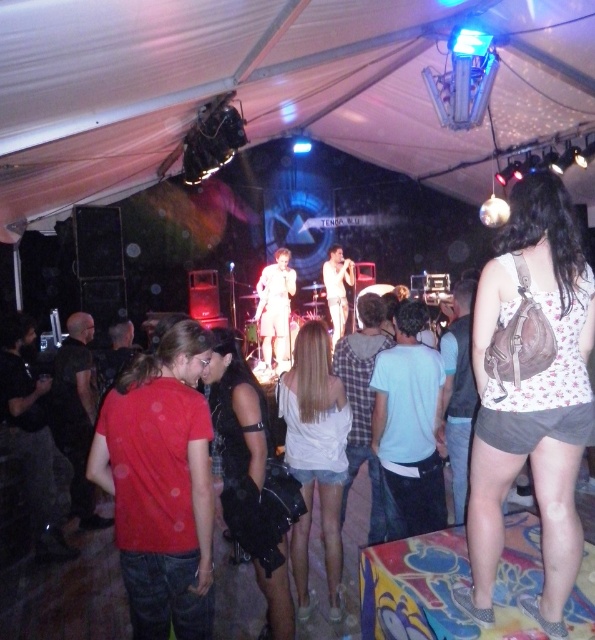
Is point (577, 401) behind point (289, 307)?

No, it is in front of (289, 307).

Measure the distance between floral-patterned fabric top at center-right and camera.

The distance of floral-patterned fabric top at center-right from camera is 6.03 feet.

Is point (493, 429) positioned in front of point (292, 292)?

Yes.

At what (x,y) coordinates should I click in order to perform the action: click on floral-patterned fabric top at center-right. Please return your answer as a coordinate pair (x, y). This screenshot has height=640, width=595. Looking at the image, I should click on (530, 394).

The height and width of the screenshot is (640, 595). What do you see at coordinates (530, 394) in the screenshot?
I see `floral-patterned fabric top at center-right` at bounding box center [530, 394].

Which is behind, point (566, 268) or point (299, 588)?

The point (299, 588) is behind.

You are a GUI agent. You are given a task and a screenshot of the screen. Output one action in this format:
    pyautogui.click(x=<x>, y=<y>)
    Task: Click on the floral-patterned fabric top at center-right
    Image resolution: width=595 pixels, height=640 pixels.
    Given the screenshot: What is the action you would take?
    pyautogui.click(x=530, y=394)

Is floral-patterned fabric top at center-right above white glossy shirt at center?

No.

Between floral-patterned fabric top at center-right and white glossy shirt at center, which one appears on the right side from the viewer's perspective?

floral-patterned fabric top at center-right is more to the right.

Where is `floral-patterned fabric top at center-right`? The image size is (595, 640). floral-patterned fabric top at center-right is located at coordinates (530, 394).